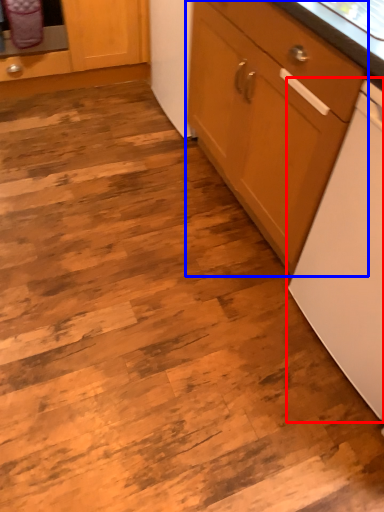
Question: Which of the following is the closest to the observer, home appliance (highlighted by a red box) or cabinetry (highlighted by a blue box)?

Choices:
 (A) home appliance
 (B) cabinetry

Answer: (A)